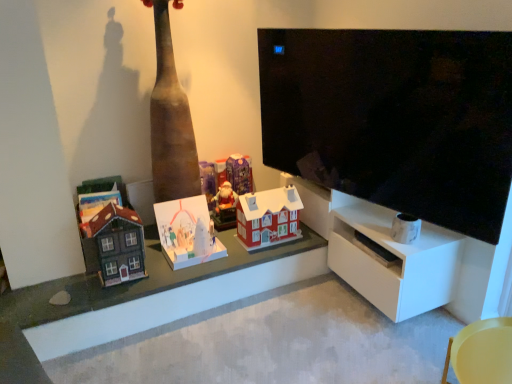
You are a GUI agent. You are given a task and a screenshot of the screen. Output one action in this format:
    pyautogui.click(x=<x>, y=<y>)
    Task: Click on the vacant area that lies to the right of matte brown wooden house at left, which appears as the 5th toy when viewed from the right
    This screenshot has width=512, height=384.
    Given the screenshot: What is the action you would take?
    pyautogui.click(x=157, y=277)